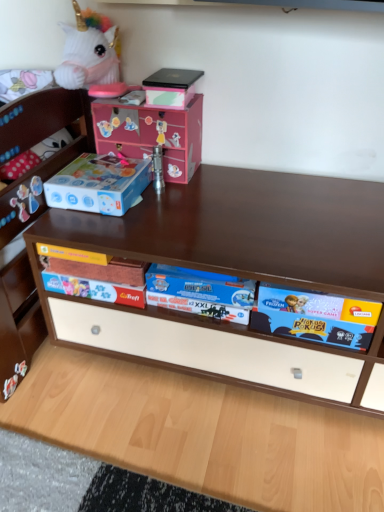
I want to click on free space in front of blue cardboard storage box at left, so click(x=98, y=231).